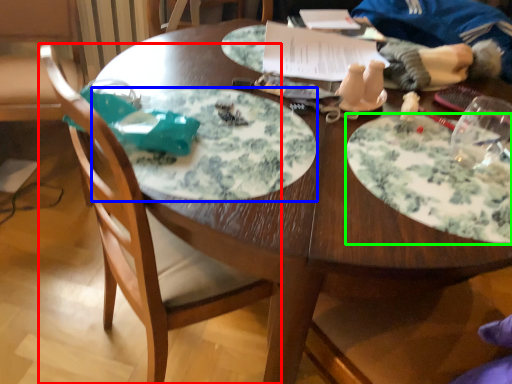
Question: Which object is the farthest from chair (highlighted by a red box)? Choose among these: plate (highlighted by a blue box) or plate (highlighted by a green box).

Choices:
 (A) plate
 (B) plate

Answer: (B)